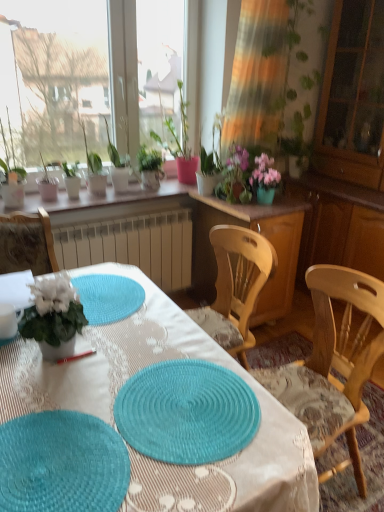
This screenshot has height=512, width=384. Find the location of `vacant space in teal woven placemat at center, the 2th mat positioned from the left (from a real-world perspective)`. vacant space in teal woven placemat at center, the 2th mat positioned from the left (from a real-world perspective) is located at coordinates (196, 412).